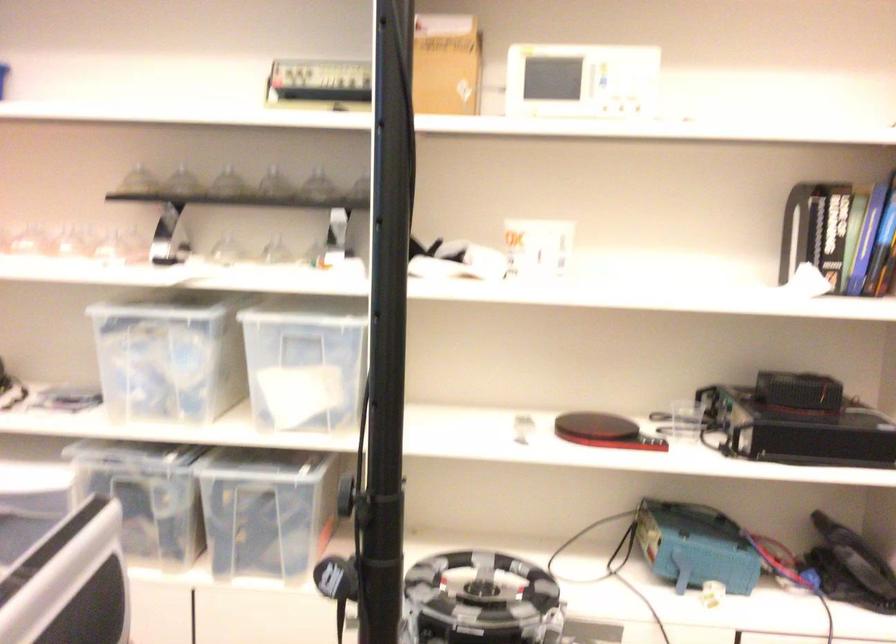
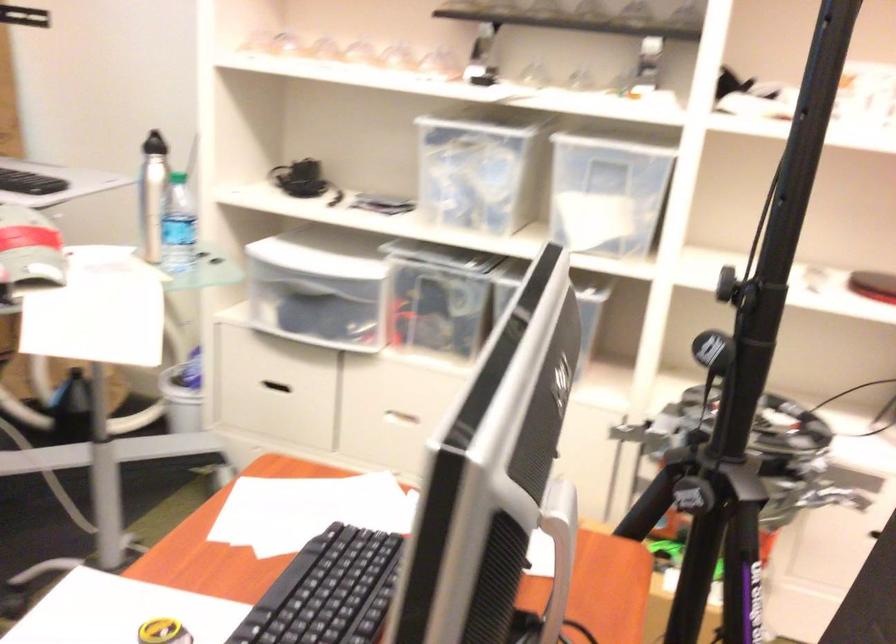
What movement of the cameraman would produce the second image?

The movement direction of the cameraman is left, backward.